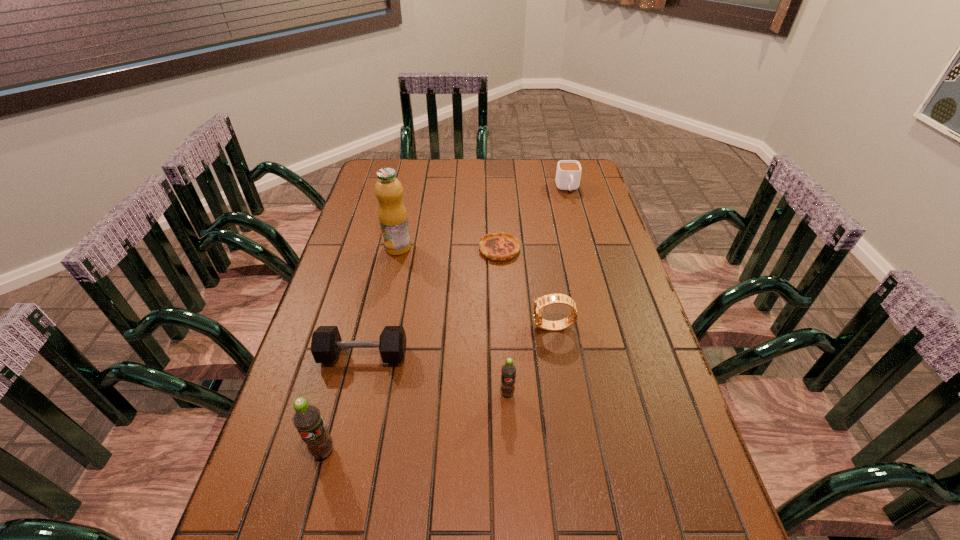
Locate an element on the screen. This screenshot has width=960, height=540. dumbbell is located at coordinates [326, 343].

What are the coordinates of `vacant region located on the front label of the left soda` in the screenshot? It's located at coord(312,493).

Where is `free spot located on the front label of the farther soda`? Image resolution: width=960 pixels, height=540 pixels. free spot located on the front label of the farther soda is located at coordinates (513, 491).

The image size is (960, 540). Find the location of `free space located 0.360m on the front of the shortest object`. free space located 0.360m on the front of the shortest object is located at coordinates (505, 354).

You are a GUI agent. You are given a task and a screenshot of the screen. Output one action in this format:
    pyautogui.click(x=<x>, y=<y>)
    Task: Click on the vacant space positioned 0.230m on the side with the handle of the farthest object
    This screenshot has width=960, height=540.
    Given the screenshot: What is the action you would take?
    pyautogui.click(x=580, y=235)

What are the coordinates of `free space located on the front label of the fruit juice` in the screenshot? It's located at pos(389,291).

This screenshot has height=540, width=960. I want to click on blank space located on the face of the watch, so tap(405, 327).

At what (x,y) coordinates should I click in order to perform the action: click on free space located 0.090m on the face of the watch. Please return your answer as a coordinate pair (x, y). Image resolution: width=960 pixels, height=540 pixels. Looking at the image, I should click on (500, 327).

You are a GUI agent. You are given a task and a screenshot of the screen. Output one action in this format:
    pyautogui.click(x=<x>, y=<y>)
    Task: Click on the vacant point located on the face of the watch
    The width and height of the screenshot is (960, 540).
    Given the screenshot: What is the action you would take?
    pyautogui.click(x=464, y=327)

Identify the location of vacant point located on the front of the dumbbell. This screenshot has width=960, height=540. (342, 446).